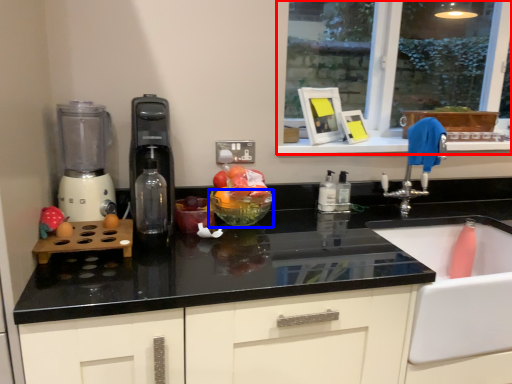
Question: Which object is closer to the camera taking this photo, window (highlighted by a red box) or glass bowl (highlighted by a blue box)?

Choices:
 (A) window
 (B) glass bowl

Answer: (B)